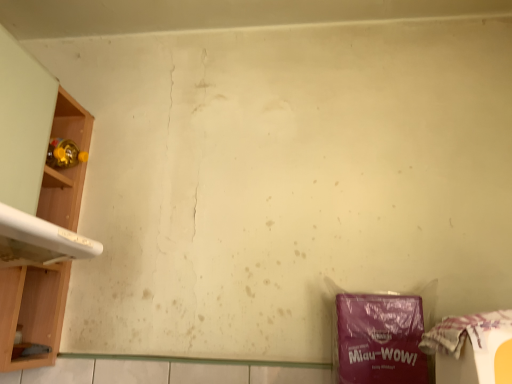
Measure the distance between plastic bag at lower right and camera.

plastic bag at lower right is 20.47 inches from camera.

The height and width of the screenshot is (384, 512). What do you see at coordinates (379, 339) in the screenshot?
I see `purple matte plastic bag at lower right` at bounding box center [379, 339].

The width and height of the screenshot is (512, 384). Describe the element at coordinates (32, 311) in the screenshot. I see `wooden shelf at left` at that location.

The height and width of the screenshot is (384, 512). What do you see at coordinates (39, 240) in the screenshot? I see `white glossy washing machine at left` at bounding box center [39, 240].

You are a GUI agent. You are given a task and a screenshot of the screen. Output one action in this format:
    pyautogui.click(x=<x>, y=<y>)
    Task: Click on the plastic bag at lower right
    The width and height of the screenshot is (512, 384).
    Given the screenshot: What is the action you would take?
    pyautogui.click(x=472, y=348)

The width and height of the screenshot is (512, 384). In the image, there is a white glossy washing machine at left. What are the coordinates of `waste below it (from a real-world perspective)` in the screenshot? It's located at (472, 348).

Between point (445, 372) and point (9, 212), which one is positioned behind?

The point (9, 212) is farther.

Is plastic bag at lower right outside of white glossy washing machine at left?

That's correct, plastic bag at lower right is outside of white glossy washing machine at left.

Considering the relative sizes of plastic bag at lower right and white glossy washing machine at left in the image provided, is plastic bag at lower right shorter than white glossy washing machine at left?

Yes, plastic bag at lower right is shorter than white glossy washing machine at left.

In the scene shown: How many degrees apart are the facing directions of purple matte plastic bag at lower right and white glossy washing machine at left?

They differ by 89.8 degrees in their facing directions.

From the image's perspective, which is above, purple matte plastic bag at lower right or white glossy washing machine at left?

white glossy washing machine at left is shown above in the image.

Which point is more distant from viewer, (365, 381) or (16, 223)?

The point (365, 381) is more distant.

Considering the sizes of objects purple matte plastic bag at lower right and white glossy washing machine at left in the image provided, who is thinner, purple matte plastic bag at lower right or white glossy washing machine at left?

purple matte plastic bag at lower right is thinner.

Is white glossy washing machine at left oriented towards plastic bag at lower right?

Yes, white glossy washing machine at left is turned towards plastic bag at lower right.

Is white glossy washing machine at left smaller than plastic bag at lower right?

No.

Identify the location of waste that is below the white glossy washing machine at left (from the image's perspective). This screenshot has height=384, width=512. (472, 348).

How distant is white glossy washing machine at left from plastic bag at lower right?

white glossy washing machine at left and plastic bag at lower right are 28.35 inches apart.

From a real-world perspective, who is located lower, purple matte plastic bag at lower right or wooden shelf at left?

purple matte plastic bag at lower right is physically lower.

Does purple matte plastic bag at lower right contain wooden shelf at left?

No, wooden shelf at left is located outside of purple matte plastic bag at lower right.

Which object is positioned more to the right, purple matte plastic bag at lower right or wooden shelf at left?

From the viewer's perspective, purple matte plastic bag at lower right appears more on the right side.

At what (x,y) coordinates should I click in order to perform the action: click on writing that appears on the right of wooden shelf at left. Please return your answer as a coordinate pair (x, y). This screenshot has width=512, height=384. Looking at the image, I should click on (379, 339).

Between white glossy washing machine at left and purple matte plastic bag at lower right, which one has smaller width?

With smaller width is purple matte plastic bag at lower right.

From the image's perspective, between white glossy washing machine at left and purple matte plastic bag at lower right, who is located below?

purple matte plastic bag at lower right is shown below in the image.

Is white glossy washing machine at left far away from purple matte plastic bag at lower right?

No, there isn't a large distance between white glossy washing machine at left and purple matte plastic bag at lower right.

Which of these two, white glossy washing machine at left or wooden shelf at left, stands taller?

With more height is wooden shelf at left.

Is white glossy washing machine at left touching wooden shelf at left?

white glossy washing machine at left and wooden shelf at left are not in contact.

Where is `washing located in front of the wooden shelf at left`? Image resolution: width=512 pixels, height=384 pixels. washing located in front of the wooden shelf at left is located at coordinates (39, 240).

Is white glossy washing machine at left situated inside wooden shelf at left or outside?

white glossy washing machine at left is located beyond the bounds of wooden shelf at left.

Is plastic bag at lower right beside purple matte plastic bag at lower right?

No, plastic bag at lower right is not with purple matte plastic bag at lower right.

Can you confirm if plastic bag at lower right is thinner than purple matte plastic bag at lower right?

No.

In the scene shown: Is purple matte plastic bag at lower right at the back of plastic bag at lower right?

Yes, plastic bag at lower right is facing away from purple matte plastic bag at lower right.

I want to click on waste in front of the white glossy washing machine at left, so click(472, 348).

Find the location of `washing that is above the purple matte plastic bag at lower right (from a real-world perspective)`. washing that is above the purple matte plastic bag at lower right (from a real-world perspective) is located at coordinates (39, 240).

Considering their positions, is wooden shelf at left positioned further to white glossy washing machine at left than purple matte plastic bag at lower right?

purple matte plastic bag at lower right.

Based on their spatial positions, is purple matte plastic bag at lower right or plastic bag at lower right further from wooden shelf at left?

plastic bag at lower right lies further to wooden shelf at left than the other object.

Based on their spatial positions, is white glossy washing machine at left or purple matte plastic bag at lower right further from plastic bag at lower right?

white glossy washing machine at left lies further to plastic bag at lower right than the other object.

Estimate the real-world distances between objects in this image. Which object is further from white glossy washing machine at left, purple matte plastic bag at lower right or wooden shelf at left?

purple matte plastic bag at lower right is further to white glossy washing machine at left.

Looking at the image, which one is located closer to white glossy washing machine at left, plastic bag at lower right or wooden shelf at left?

wooden shelf at left is closer to white glossy washing machine at left.

Based on their spatial positions, is purple matte plastic bag at lower right or wooden shelf at left closer to plastic bag at lower right?

purple matte plastic bag at lower right is positioned closer to the anchor plastic bag at lower right.

Considering their positions, is plastic bag at lower right positioned further to purple matte plastic bag at lower right than white glossy washing machine at left?

white glossy washing machine at left.

Based on their spatial positions, is white glossy washing machine at left or wooden shelf at left closer to plastic bag at lower right?

Based on the image, white glossy washing machine at left appears to be nearer to plastic bag at lower right.

At what (x,y) coordinates should I click in order to perform the action: click on washing between wooden shelf at left and purple matte plastic bag at lower right in the horizontal direction. Please return your answer as a coordinate pair (x, y). This screenshot has width=512, height=384. Looking at the image, I should click on (39, 240).

Locate an element on the screen. This screenshot has height=384, width=512. washing between wooden shelf at left and plastic bag at lower right from left to right is located at coordinates (39, 240).

In order to click on writing located between wooden shelf at left and plastic bag at lower right in the left-right direction in this screenshot , I will do `click(379, 339)`.

Find the location of a particular element. This screenshot has width=512, height=384. writing situated between white glossy washing machine at left and plastic bag at lower right from left to right is located at coordinates point(379,339).